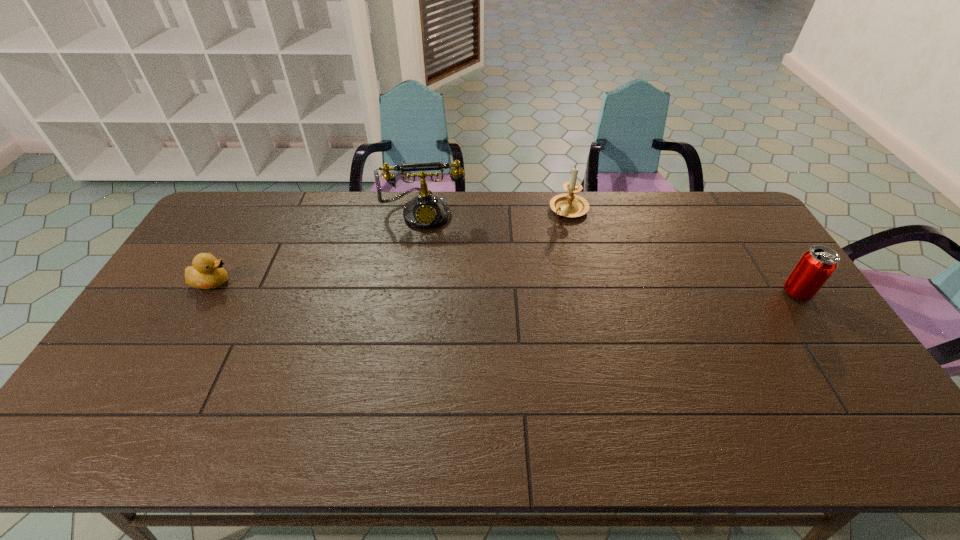
At what (x,y) coordinates should I click in order to perform the action: click on the shortest object. Please return your answer as a coordinate pair (x, y). This screenshot has height=540, width=960. Looking at the image, I should click on (207, 272).

Identify the location of the leftmost object. Image resolution: width=960 pixels, height=540 pixels. (207, 272).

Image resolution: width=960 pixels, height=540 pixels. Find the location of `soda can`. soda can is located at coordinates (817, 264).

Where is `candle holder`? This screenshot has width=960, height=540. candle holder is located at coordinates (568, 205).

Identify the location of the second object from left to right. (425, 211).

You are a GUI agent. You are given a task and a screenshot of the screen. Output one action in this format:
    pyautogui.click(x=<x>, y=<y>)
    Task: Click on the telephone
    
    Given the screenshot: What is the action you would take?
    pyautogui.click(x=425, y=211)

Where is `vacant point located 0.360m facing forward on the leftmost object`? Image resolution: width=960 pixels, height=540 pixels. vacant point located 0.360m facing forward on the leftmost object is located at coordinates (350, 282).

This screenshot has width=960, height=540. In order to click on vacant region located 0.170m on the back of the rightmost object in this screenshot , I will do `click(765, 246)`.

I want to click on vacant space situated 0.210m with a handle on the side of the third object from left to right, so click(528, 252).

Locate an element on the screen. The image size is (960, 540). free location located 0.350m with a handle on the side of the third object from left to right is located at coordinates (504, 276).